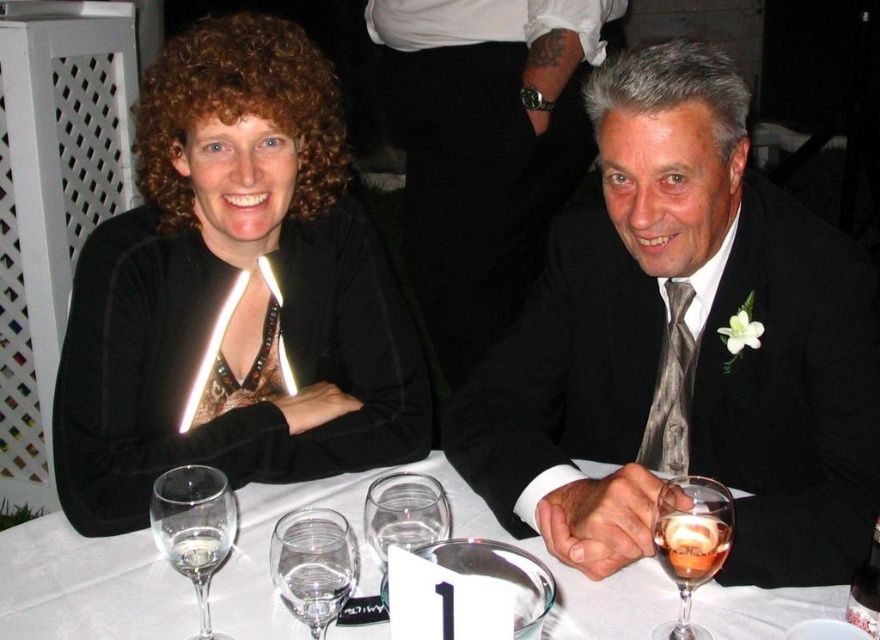
Question: Can you confirm if clear glass wine glass at center is positioned to the left of translucent glass wine glass at lower right?

Choices:
 (A) no
 (B) yes

Answer: (B)

Question: Does shiny black suit at center appear on the left side of transparent glass wine glass at center?

Choices:
 (A) no
 (B) yes

Answer: (A)

Question: Which point is farther to the camera?

Choices:
 (A) clear glass wine glass at lower left
 (B) black satin dress at upper left
 (C) clear glass wine at center
 (D) shiny black suit at center

Answer: (B)

Question: Where is translucent glass wine glass at lower right located in relation to transparent glass wine glass at center in the image?

Choices:
 (A) left
 (B) right

Answer: (B)

Question: Among these points, which one is nearest to the camera?

Choices:
 (A) (796, 481)
 (B) (155, 412)

Answer: (A)

Question: Which is farther from the clear glass wine glass at center?

Choices:
 (A) black satin dress at upper left
 (B) clear glass wine glass at lower left

Answer: (A)